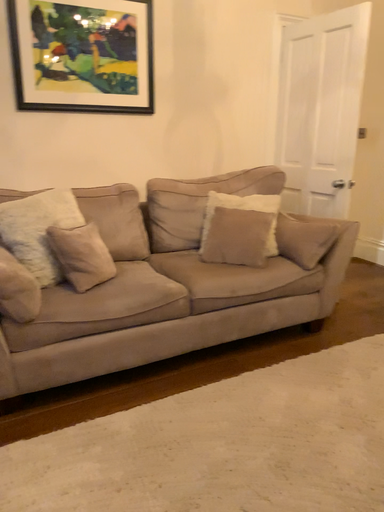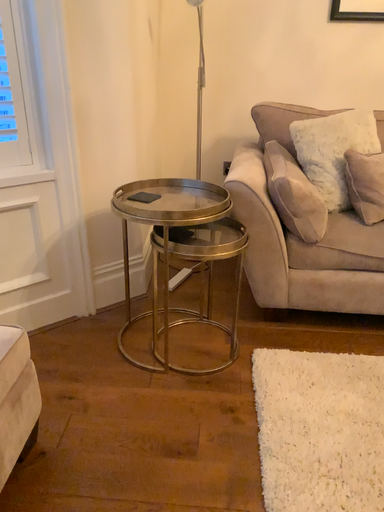
Question: Which way did the camera rotate in the video?

Choices:
 (A) rotated right
 (B) rotated left

Answer: (B)